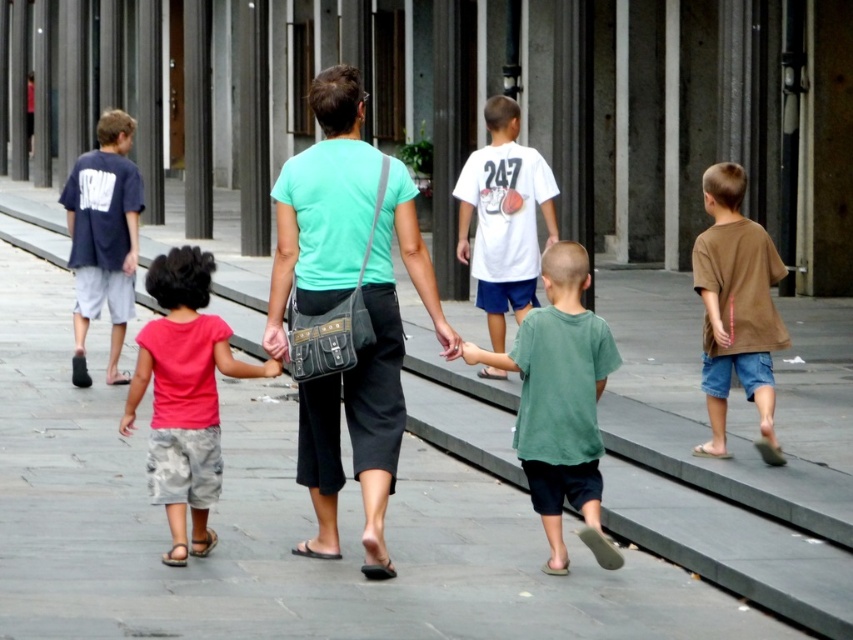
Question: Does gray concrete pavement at center have a greater width compared to matte green shirt at center?

Choices:
 (A) yes
 (B) no

Answer: (A)

Question: Can you confirm if brown cotton shirt at right is positioned below dark blue cotton shirt at left?

Choices:
 (A) yes
 (B) no

Answer: (A)

Question: Among these objects, which one is farthest from the camera?

Choices:
 (A) matte pink shirt at center
 (B) gray concrete pavement at center
 (C) green cotton shirt at center

Answer: (A)

Question: Does matte pink shirt at center have a lesser width compared to brown cotton shirt at right?

Choices:
 (A) no
 (B) yes

Answer: (A)

Question: Which point is farther to the camera?

Choices:
 (A) matte pink shirt at center
 (B) dark blue cotton shirt at left

Answer: (B)

Question: Estimate the real-world distances between objects in this image. Which object is farther from the white cotton t-shirt at center?

Choices:
 (A) matte green shirt at center
 (B) brown cotton shirt at right

Answer: (A)